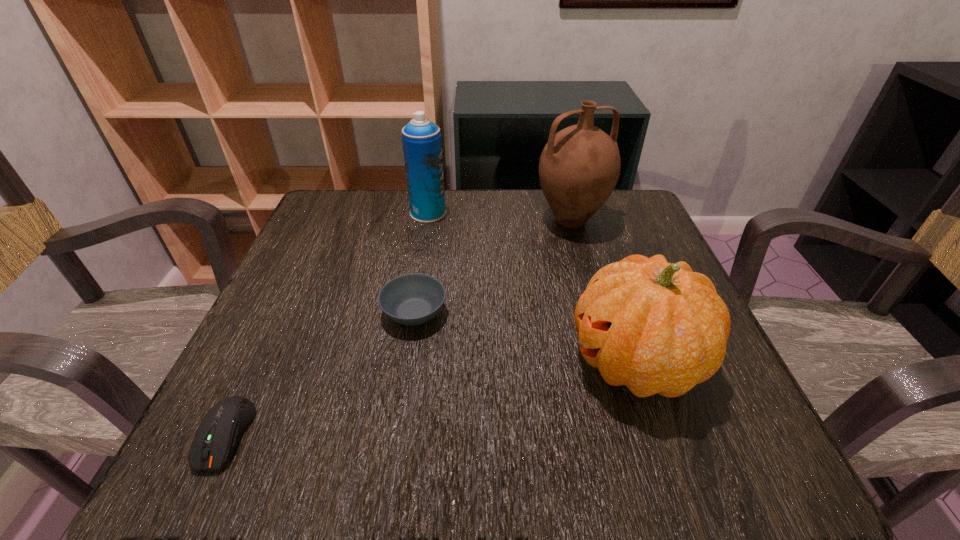
Where is `object at the far right corner`? The height and width of the screenshot is (540, 960). object at the far right corner is located at coordinates (579, 167).

Identify the location of object that is at the near right corner. The width and height of the screenshot is (960, 540). coord(656,327).

This screenshot has height=540, width=960. Identify the location of free point at the far edge. (388, 218).

Identify the location of free space at the near edge. The width and height of the screenshot is (960, 540). (649, 474).

This screenshot has width=960, height=540. In the image, there is a desktop. In order to click on vacant space at the left edge in this screenshot , I will do `click(330, 258)`.

In the image, there is a desktop. At what (x,y) coordinates should I click in order to perform the action: click on vacant space at the right edge. Please return your answer as a coordinate pair (x, y). Image resolution: width=960 pixels, height=540 pixels. Looking at the image, I should click on (648, 416).

At what (x,y) coordinates should I click in order to perform the action: click on vacant space at the far left corner of the desktop. Please return your answer as a coordinate pair (x, y). Image resolution: width=960 pixels, height=540 pixels. Looking at the image, I should click on (373, 193).

Where is `free space between the pitcher and the leftmost object`? This screenshot has width=960, height=540. free space between the pitcher and the leftmost object is located at coordinates (398, 327).

This screenshot has width=960, height=540. In order to click on vacant space in between the aerosol can and the leftmost object in this screenshot , I will do `click(327, 323)`.

Image resolution: width=960 pixels, height=540 pixels. In order to click on vacant area that lies between the leftmost object and the aerosol can in this screenshot , I will do `click(327, 323)`.